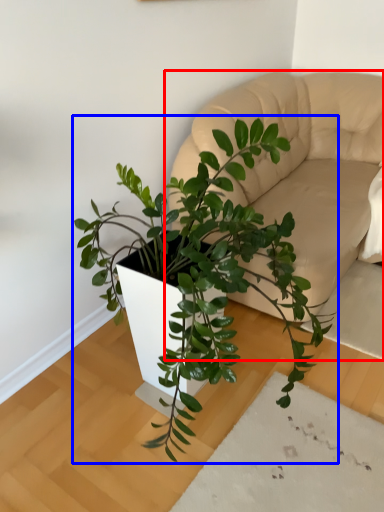
Question: Which point is further to the camera, couch (highlighted by a red box) or houseplant (highlighted by a blue box)?

Choices:
 (A) couch
 (B) houseplant

Answer: (A)